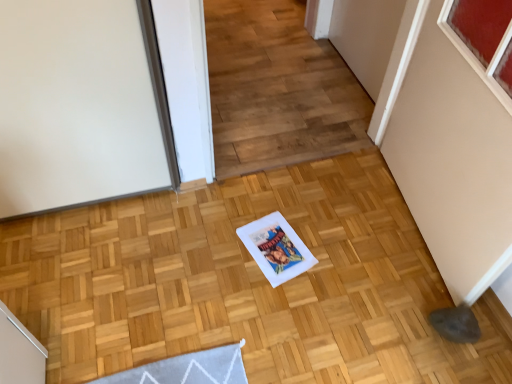
Question: Should I look upward or downward to see white glossy postcard at center?

Choices:
 (A) down
 (B) up

Answer: (A)